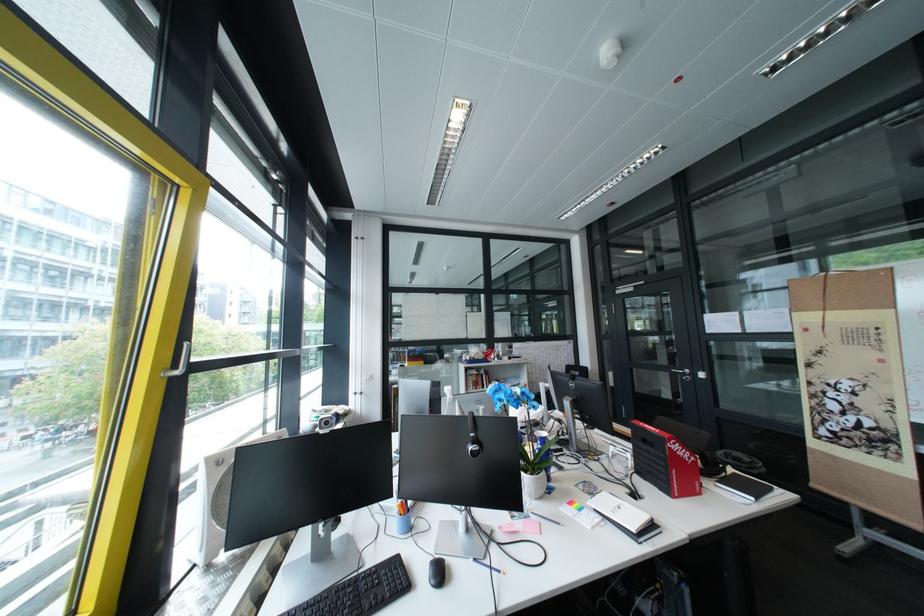
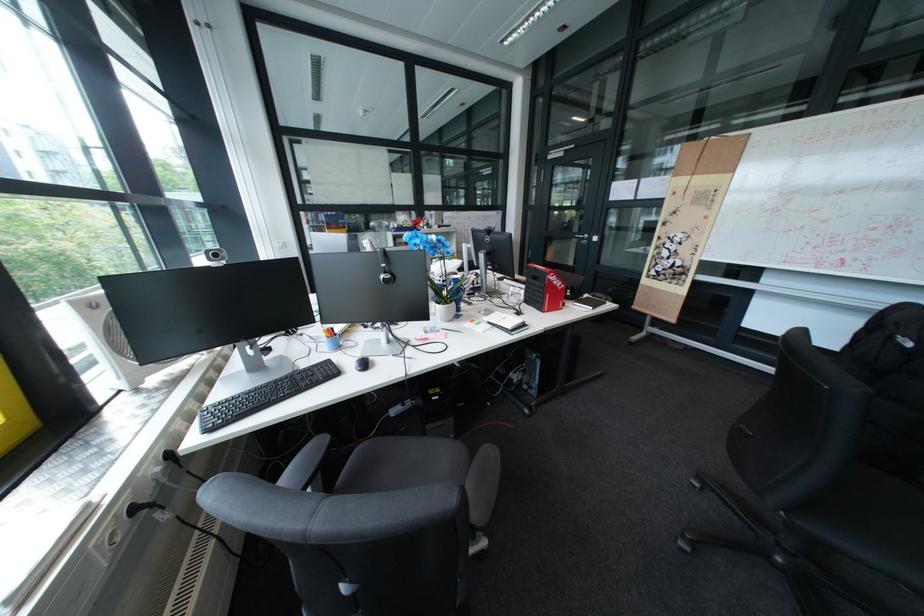
Find the pixel in the second image that matches pixel 650 476 in the first image.

(538, 304)